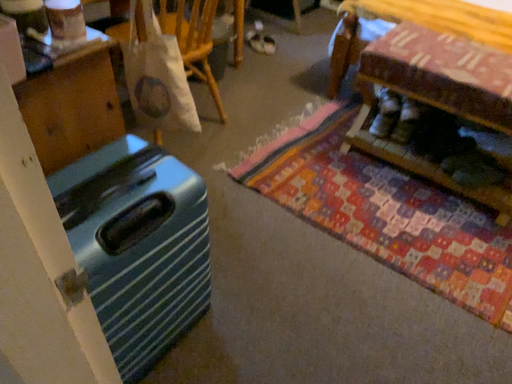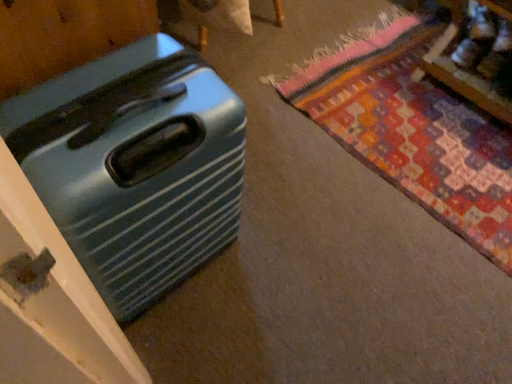
Question: How did the camera likely rotate when shooting the video?

Choices:
 (A) rotated downward
 (B) rotated upward

Answer: (A)